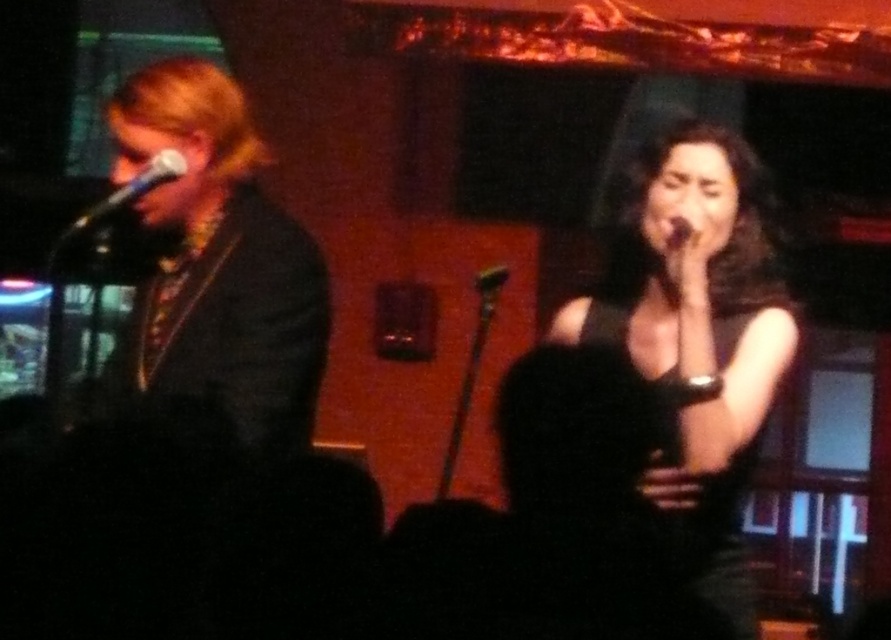
Which is in front, point (706, 404) or point (304, 364)?

Point (706, 404)

Identify the location of black matte dress at center. (699, 340).

Is black matte dress at center below black matte microphone at center?

Indeed, black matte dress at center is positioned under black matte microphone at center.

Does point (714, 472) lie in front of point (493, 269)?

That is True.

The width and height of the screenshot is (891, 640). I want to click on black matte dress at center, so click(x=699, y=340).

Which is below, shiny black jacket at left or metallic silver microphone at left?

shiny black jacket at left

Who is more distant from viewer, (264,428) or (90,209)?

The point (90,209) is behind.

Is point (194, 396) closer to viewer compared to point (69, 228)?

That is True.

Where is `shiny black jacket at left`? This screenshot has height=640, width=891. shiny black jacket at left is located at coordinates (218, 264).